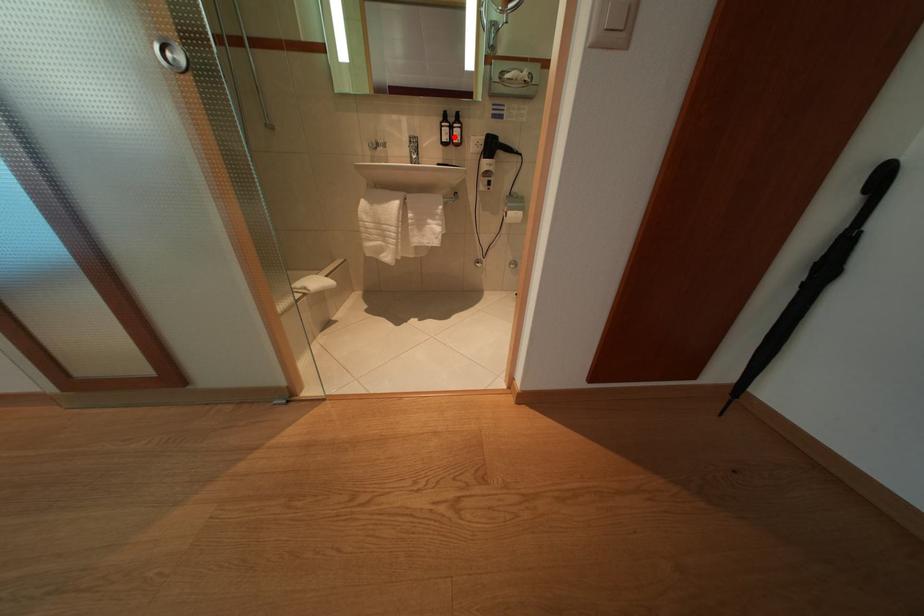
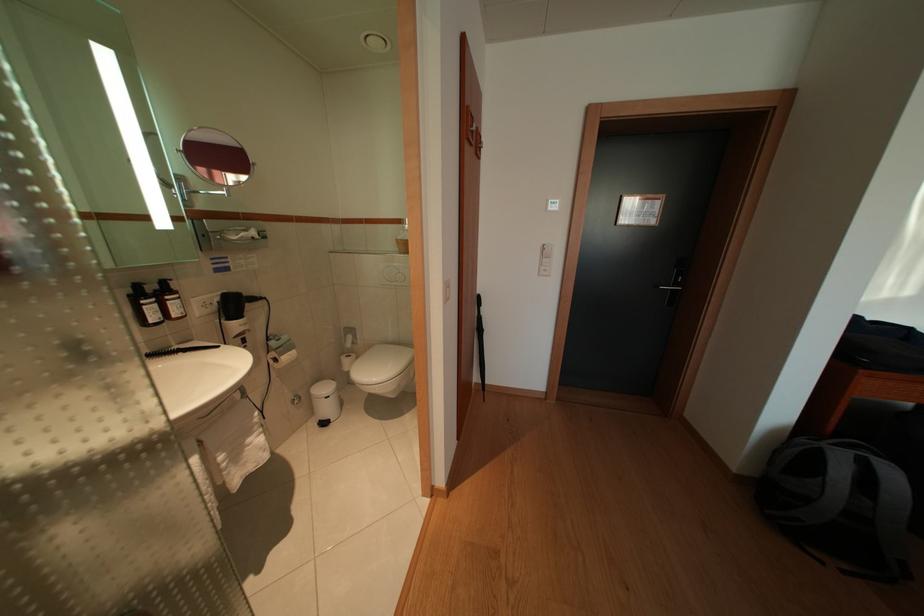
Question: I am providing you with two images of the same scene from different viewpoints. A red point is shown in image1. For the corresponding object point in image2, is it positioned nearer or farther from the camera?

Choices:
 (A) Nearer
 (B) Farther

Answer: (B)